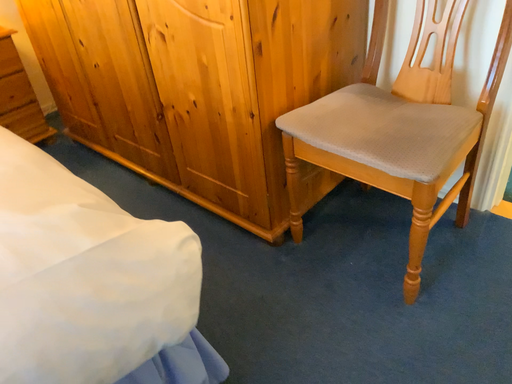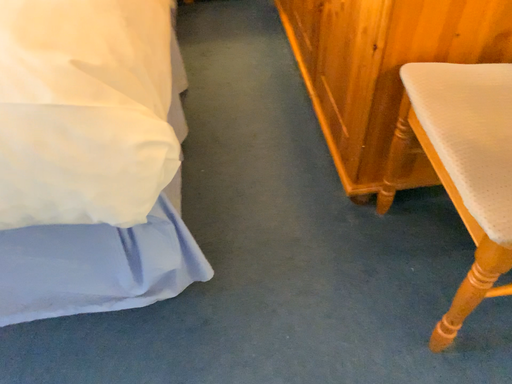
Question: How did the camera likely rotate when shooting the video?

Choices:
 (A) rotated right
 (B) rotated left

Answer: (B)